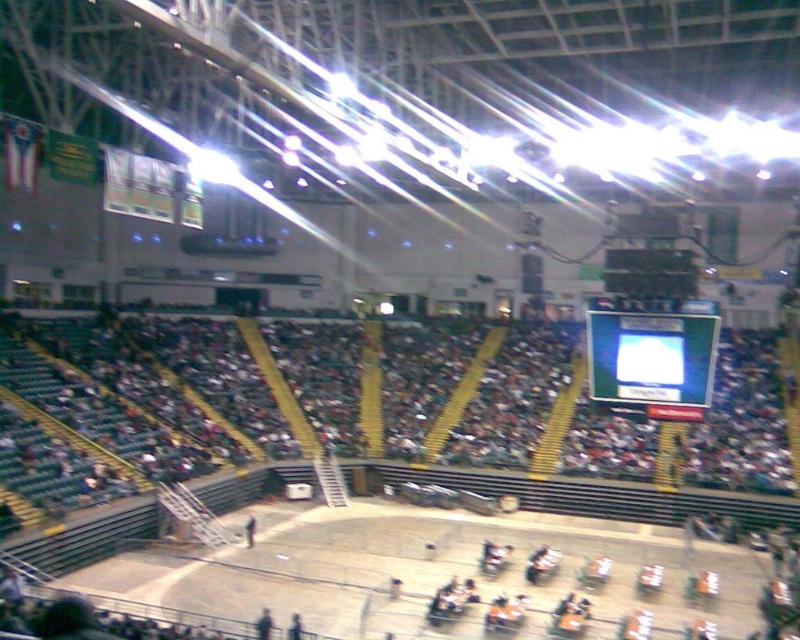
You are a stage manager in the arena and need to place a 10 meter long banner between the dark gray seats at center and the matte black scoreboard at upper center. Is there enough space for the banner?

The distance between the dark gray seats at center and the matte black scoreboard at upper center is 15.38 meters, so yes, there is enough space to place a 10 meter long banner between them.

You are a stage manager in the arena and need to adjust the lighting to ensure both the matte black scoreboard at upper center and the black glossy scoreboard at upper center are clearly visible to the audience. Which scoreboard might require additional lighting adjustments due to its position relative to the overhead lights?

The black glossy scoreboard at upper center might require additional lighting adjustments because it is behind the matte black scoreboard at upper center, which could cast a shadow or reduce its visibility under the overhead lights.

You are an event organizer who needs to set up a new banner between the dark gray seats at center and the matte black scoreboard at upper center. Based on their positions, where should you place the banner so it is visible to both areas?

The banner should be placed between the dark gray seats at center and the matte black scoreboard at upper center, hanging from above the dark gray seats at center since it is positioned under the matte black scoreboard at upper center, ensuring visibility from both areas.